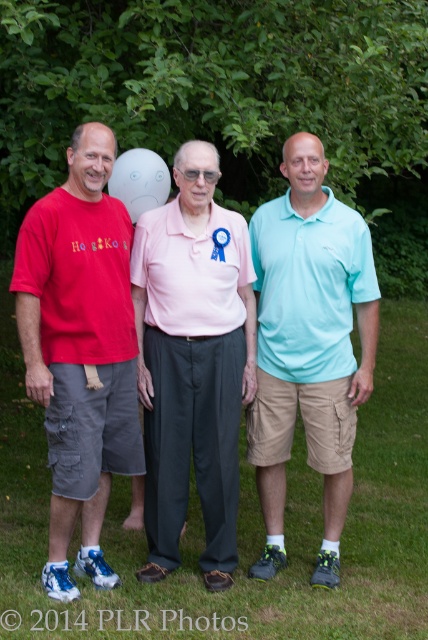
Question: Is the position of matte pink shirt at center less distant than that of matte red t-shirt at left?

Choices:
 (A) no
 (B) yes

Answer: (A)

Question: Estimate the real-world distances between objects in this image. Which object is farther from the matte red t-shirt at left?

Choices:
 (A) matte pink shirt at center
 (B) white matte balloon at center
 (C) pink fabric shirt at center

Answer: (B)

Question: Based on their relative distances, which object is farther from the matte red t-shirt at left?

Choices:
 (A) light blue cotton polo shirt at center
 (B) matte pink shirt at center
 (C) pink fabric shirt at center
 (D) white matte balloon at center

Answer: (D)

Question: Considering the real-world distances, which object is closest to the light blue cotton polo shirt at center?

Choices:
 (A) pink fabric shirt at center
 (B) matte red t-shirt at left
 (C) white matte balloon at center
 (D) matte pink shirt at center

Answer: (A)

Question: From the image, what is the correct spatial relationship of matte red t-shirt at left in relation to light blue cotton polo shirt at center?

Choices:
 (A) below
 (B) above

Answer: (B)

Question: Can you confirm if matte red t-shirt at left is bigger than white matte balloon at center?

Choices:
 (A) no
 (B) yes

Answer: (B)